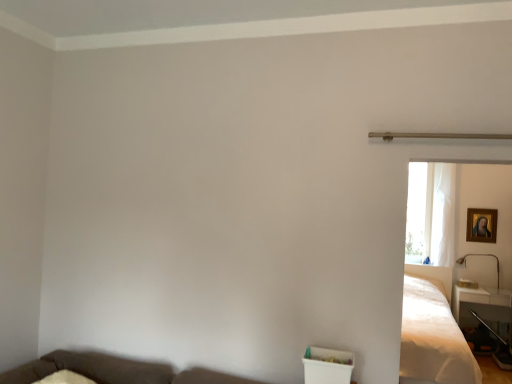
The image size is (512, 384). What do you see at coordinates (481, 255) in the screenshot?
I see `metallic gold lamp at right` at bounding box center [481, 255].

Describe the element at coordinates (481, 305) in the screenshot. I see `white glossy table at lower right` at that location.

Where is `white glossy table at lower right`? The image size is (512, 384). white glossy table at lower right is located at coordinates (481, 305).

Find the location of a particular element. The height and width of the screenshot is (384, 512). gold-framed painting at upper right is located at coordinates (481, 225).

Identify the location of white satin bed at right. point(432,337).

Locate an element on the screen. metallic gold lamp at right is located at coordinates (481, 255).

Which is behind, white sheer curtain at right or gold-framed painting at upper right?

gold-framed painting at upper right is behind.

Looking at this image, is white sheer curtain at right beside gold-framed painting at upper right?

white sheer curtain at right is not next to gold-framed painting at upper right, and they're not touching.

Measure the distance between white sheer curtain at right and gold-framed painting at upper right.

18.70 inches.

Would you say white sheer curtain at right is outside gold-framed painting at upper right?

That's correct, white sheer curtain at right is outside of gold-framed painting at upper right.

Would you consider metallic gold lamp at right to be distant from white sheer curtain at right?

No, there isn't a large distance between metallic gold lamp at right and white sheer curtain at right.

In the scene shown: Who is more distant, metallic gold lamp at right or white sheer curtain at right?

white sheer curtain at right.

How many degrees apart are the facing directions of metallic gold lamp at right and white sheer curtain at right?

There is a 92.9-degree angle between the facing directions of metallic gold lamp at right and white sheer curtain at right.

Locate an element on the screen. This screenshot has width=512, height=384. lamp below the white sheer curtain at right (from a real-world perspective) is located at coordinates (481, 255).

Is white satin bed at right placed right next to white sheer curtain at right?

No, white satin bed at right is not making contact with white sheer curtain at right.

Does white satin bed at right appear on the left side of white sheer curtain at right?

Correct, you'll find white satin bed at right to the left of white sheer curtain at right.

Considering their positions, is white satin bed at right located in front of or behind white sheer curtain at right?

white satin bed at right is in front of white sheer curtain at right.

Choose the correct answer: Is white satin bed at right inside white sheer curtain at right or outside it?

white satin bed at right is not inside white sheer curtain at right, it's outside.

Is metallic gold lamp at right positioned far away from white satin bed at right?

That's right, there is a large distance between metallic gold lamp at right and white satin bed at right.

This screenshot has height=384, width=512. In order to click on bed on the left of metallic gold lamp at right in this screenshot , I will do 432,337.

Does point (497, 262) come in front of point (452, 378)?

No, it is not.

Is gold-framed painting at upper right situated inside brown fabric couch at lower left or outside?

gold-framed painting at upper right lies outside brown fabric couch at lower left.

At what (x,y) coordinates should I click in order to perform the action: click on couch that is on the left side of gold-framed painting at upper right. Please return your answer as a coordinate pair (x, y). Image resolution: width=512 pixels, height=384 pixels. Looking at the image, I should click on (114, 370).

From the image's perspective, is gold-framed painting at upper right above brown fabric couch at lower left?

Yes.

Looking at this image, is gold-framed painting at upper right aimed at brown fabric couch at lower left?

No, gold-framed painting at upper right is not oriented towards brown fabric couch at lower left.

Does brown fabric couch at lower left have a lesser height compared to white glossy table at lower right?

Correct, brown fabric couch at lower left is not as tall as white glossy table at lower right.

Considering the relative sizes of brown fabric couch at lower left and white glossy table at lower right in the image provided, is brown fabric couch at lower left bigger than white glossy table at lower right?

Yes.

Is brown fabric couch at lower left oriented towards white glossy table at lower right?

No, brown fabric couch at lower left is not facing towards white glossy table at lower right.

Which of these two, brown fabric couch at lower left or white glossy table at lower right, is thinner?

white glossy table at lower right.

Considering the positions of objects white glossy table at lower right and white sheer curtain at right in the image provided, who is more to the right, white glossy table at lower right or white sheer curtain at right?

white glossy table at lower right is more to the right.

From a real-world perspective, does white glossy table at lower right sit lower than white sheer curtain at right?

Yes, from a real-world perspective, white glossy table at lower right is beneath white sheer curtain at right.

Could you tell me if white glossy table at lower right is facing white sheer curtain at right?

No, white glossy table at lower right is not turned towards white sheer curtain at right.

Which is correct: white glossy table at lower right is inside white sheer curtain at right, or outside of it?

white glossy table at lower right lies outside white sheer curtain at right.

Locate an element on the screen. The image size is (512, 384). curtain in front of the gold-framed painting at upper right is located at coordinates [443, 215].

At what (x,y) coordinates should I click in order to perform the action: click on curtain located above the metallic gold lamp at right (from a real-world perspective). Please return your answer as a coordinate pair (x, y). Looking at the image, I should click on (x=443, y=215).

Based on their spatial positions, is metallic gold lamp at right or white satin bed at right closer to gold-framed painting at upper right?

metallic gold lamp at right lies closer to gold-framed painting at upper right than the other object.

Which object lies further to the anchor point white glossy table at lower right, metallic gold lamp at right or gold-framed painting at upper right?

gold-framed painting at upper right is further to white glossy table at lower right.

Based on their spatial positions, is white sheer curtain at right or white satin bed at right closer to white glossy table at lower right?

The object closer to white glossy table at lower right is white sheer curtain at right.

Based on their spatial positions, is brown fabric couch at lower left or white glossy table at lower right closer to white satin bed at right?

Based on the image, white glossy table at lower right appears to be nearer to white satin bed at right.

Based on their spatial positions, is brown fabric couch at lower left or metallic gold lamp at right closer to white sheer curtain at right?

metallic gold lamp at right is positioned closer to the anchor white sheer curtain at right.

When comparing their distances from metallic gold lamp at right, does white satin bed at right or gold-framed painting at upper right seem further?

Based on the image, white satin bed at right appears to be further to metallic gold lamp at right.

Based on their spatial positions, is white glossy table at lower right or white satin bed at right further from white sheer curtain at right?

white satin bed at right is further to white sheer curtain at right.

Which object lies nearer to the anchor point white satin bed at right, white sheer curtain at right or gold-framed painting at upper right?

white sheer curtain at right is closer to white satin bed at right.

Where is `table between brown fabric couch at lower left and metallic gold lamp at right from front to back`? Image resolution: width=512 pixels, height=384 pixels. table between brown fabric couch at lower left and metallic gold lamp at right from front to back is located at coordinates (481, 305).

Where is `lamp between white sheer curtain at right and white glossy table at lower right from top to bottom`? This screenshot has width=512, height=384. lamp between white sheer curtain at right and white glossy table at lower right from top to bottom is located at coordinates (481, 255).

Where is `table between brown fabric couch at lower left and white sheer curtain at right from front to back`? table between brown fabric couch at lower left and white sheer curtain at right from front to back is located at coordinates (481, 305).

Image resolution: width=512 pixels, height=384 pixels. In order to click on lamp between white satin bed at right and white sheer curtain at right in the front-back direction in this screenshot , I will do `click(481, 255)`.